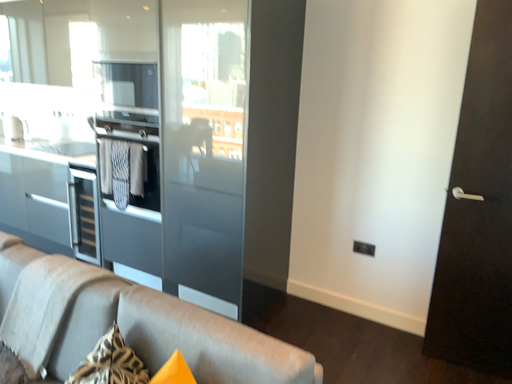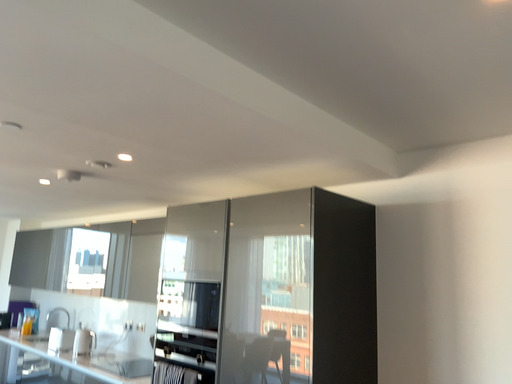
Question: How did the camera likely rotate when shooting the video?

Choices:
 (A) rotated left
 (B) rotated right

Answer: (A)